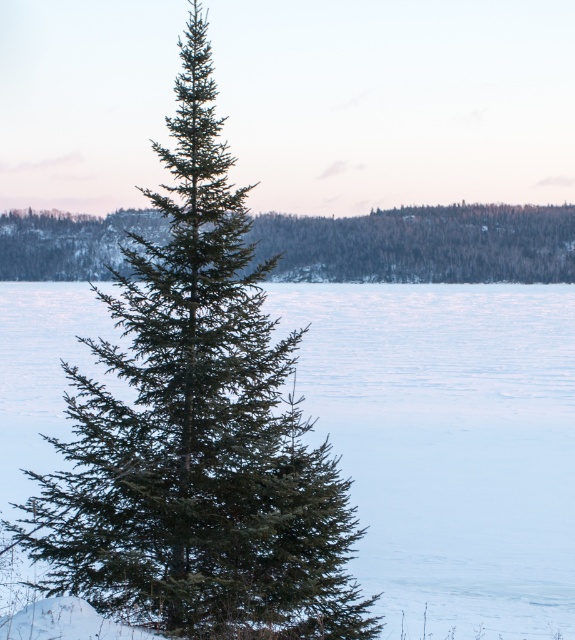
Question: Does green matte fir tree at center have a smaller size compared to white ice at center?

Choices:
 (A) yes
 (B) no

Answer: (A)

Question: Which of the following is the farthest from the observer?

Choices:
 (A) (519, 486)
 (B) (79, 243)

Answer: (B)

Question: Which point is farther from the camera taking this photo?

Choices:
 (A) (155, 298)
 (B) (82, 227)
 (C) (3, 472)

Answer: (B)

Question: Which object appears farthest from the camera in this image?

Choices:
 (A) green matte evergreen tree at center
 (B) white ice at center

Answer: (A)

Question: Can you confirm if green matte fir tree at center is wider than white ice at center?

Choices:
 (A) no
 (B) yes

Answer: (A)

Question: Is green matte fir tree at center smaller than green matte evergreen tree at center?

Choices:
 (A) yes
 (B) no

Answer: (A)